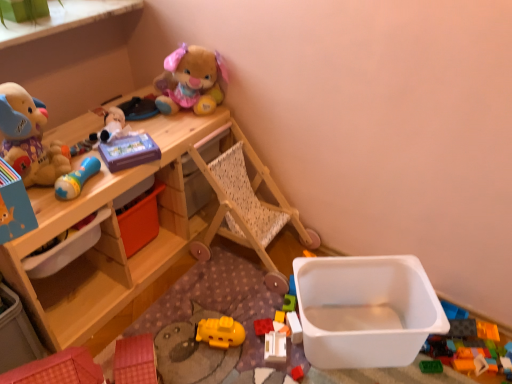
I want to click on vacant area on the back side of translucent plastic blocks at center, which ranks as the seventh toy in top-to-bottom order, so [269, 296].